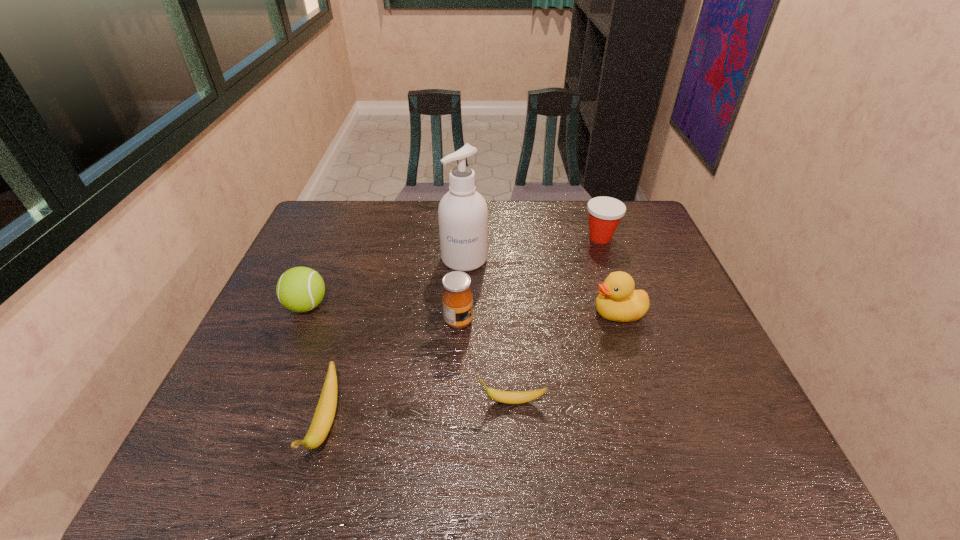
This screenshot has height=540, width=960. I want to click on free space between the tennis ball and the honey, so click(x=383, y=313).

I want to click on empty space that is in between the honey and the duck, so click(538, 317).

At what (x,y) coordinates should I click in order to perform the action: click on empty location between the second object from left to right and the leftmost object. Please return your answer as a coordinate pair (x, y). Looking at the image, I should click on (316, 364).

The height and width of the screenshot is (540, 960). Identify the location of unoccupied position between the duck and the honey. (538, 317).

Identify the location of vacant region between the Dixie cup and the honey. (529, 279).

Identify which object is located as the fourth nearest to the honey. Please provide its 2D coordinates. Your answer should be formatted as a tuple, i.e. [(x, y)], where the tuple contains the x and y coordinates of a point satisfying the conditions above.

[(617, 301)]

This screenshot has height=540, width=960. I want to click on the closest object to the Dixie cup, so click(617, 301).

Find the location of a particular element. The height and width of the screenshot is (540, 960). vacant region that satisfies the following two spatial constraints: 1. at the stem of the right banana; 2. at the stem of the taller banana is located at coordinates (513, 423).

Find the location of a particular element. This screenshot has height=540, width=960. vacant area in the image that satisfies the following two spatial constraints: 1. at the beak of the duck; 2. at the stem of the left banana is located at coordinates (654, 423).

I want to click on free space that satisfies the following two spatial constraints: 1. on the front label of the tallest object; 2. on the front-facing side of the honey, so click(x=462, y=321).